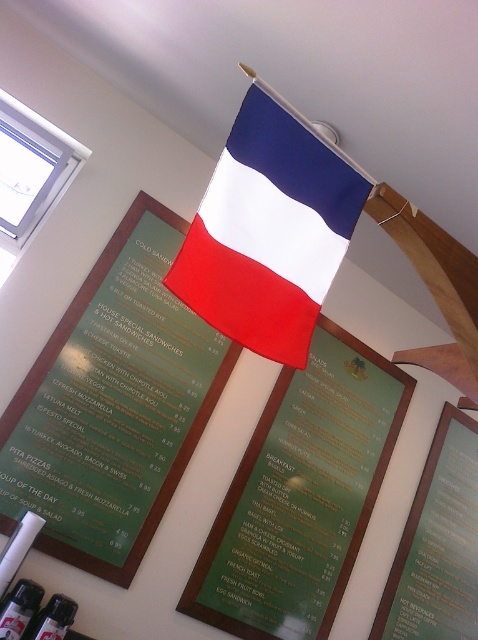
Which is behind, point (140, 253) or point (443, 420)?

The point (443, 420) is behind.

Who is taller, green matte menu board at center or green matte menu at center?

green matte menu board at center

Find the location of a particular element. Image resolution: width=478 pixels, height=640 pixels. green matte menu board at center is located at coordinates (112, 404).

Which is in front, point (120, 344) or point (249, 488)?

Point (120, 344)

Identify the location of green matte menu board at center. (112, 404).

Where is `green glossy menu at center`? Image resolution: width=478 pixels, height=640 pixels. green glossy menu at center is located at coordinates (302, 493).

Who is more forward, (351, 525) or (422, 502)?

Point (351, 525) is in front.

Locate an element on the screen. The height and width of the screenshot is (640, 478). green glossy menu at center is located at coordinates coord(302,493).